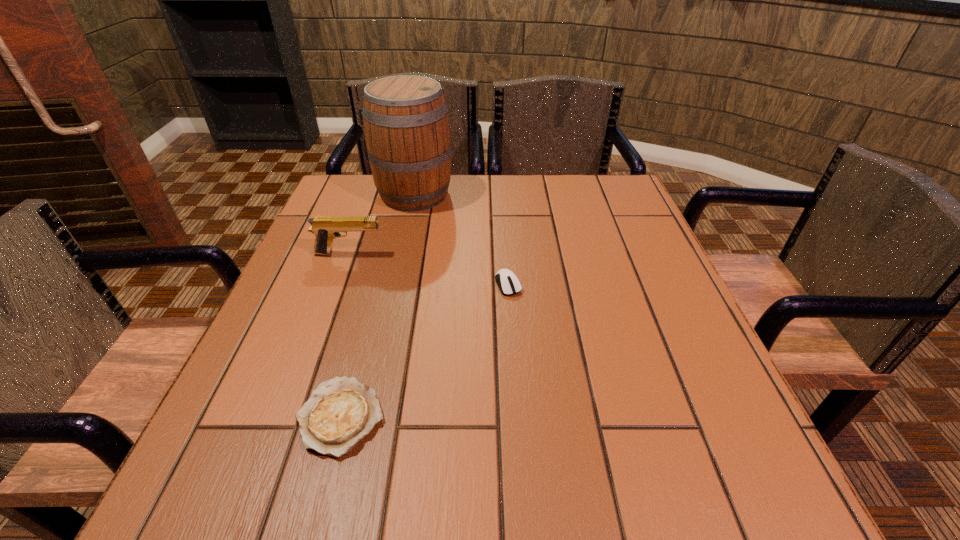
The width and height of the screenshot is (960, 540). I want to click on free space that satisfies the following two spatial constraints: 1. at the barrel of the third shortest object; 2. on the left side of the quiche, so click(x=290, y=417).

Locate an element on the screen. Image resolution: width=960 pixels, height=540 pixels. vacant position in the image that satisfies the following two spatial constraints: 1. at the barrel of the second farthest object; 2. on the right side of the rightmost object is located at coordinates (338, 285).

At what (x,y) coordinates should I click in order to perform the action: click on free location that satisfies the following two spatial constraints: 1. at the barrel of the second tallest object; 2. on the back side of the nearest object. Please return your answer as a coordinate pair (x, y). Looking at the image, I should click on (290, 417).

Image resolution: width=960 pixels, height=540 pixels. Find the location of `vacant space that satisfies the following two spatial constraints: 1. on the back side of the third tallest object; 2. at the barrel of the third shortest object`. vacant space that satisfies the following two spatial constraints: 1. on the back side of the third tallest object; 2. at the barrel of the third shortest object is located at coordinates [506, 254].

I want to click on vacant space that satisfies the following two spatial constraints: 1. at the barrel of the third nearest object; 2. on the back side of the mouse, so click(x=338, y=285).

This screenshot has height=540, width=960. I want to click on vacant region that satisfies the following two spatial constraints: 1. at the barrel of the third farthest object; 2. on the left side of the second farthest object, so click(338, 285).